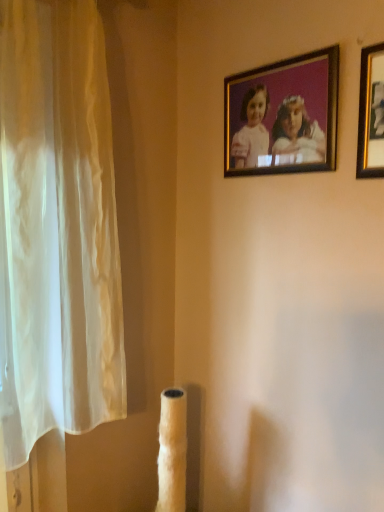
The width and height of the screenshot is (384, 512). What do you see at coordinates (371, 114) in the screenshot? I see `gold-framed picture at upper right, acting as the first picture frame starting from the right` at bounding box center [371, 114].

The width and height of the screenshot is (384, 512). I want to click on gold-framed picture at upper right, which ranks as the 2th picture frame in back-to-front order, so click(x=371, y=114).

Describe the element at coordinates (283, 114) in the screenshot. The width and height of the screenshot is (384, 512). I see `gold-framed photo at upper center, which is the first picture frame in back-to-front order` at that location.

You are a GUI agent. You are given a task and a screenshot of the screen. Output one action in this format:
    pyautogui.click(x=<x>, y=<y>)
    Task: Click on the gold-framed photo at upper center, which is the first picture frame in back-to-front order
    
    Given the screenshot: What is the action you would take?
    pyautogui.click(x=283, y=114)

Locate an element on the screen. The image size is (384, 512). gold-framed picture at upper right, which appears as the 2th picture frame when viewed from the left is located at coordinates (371, 114).

Does gold-framed picture at upper right, which appears as the 2th picture frame when viewed from the left, appear on the right side of gold-framed photo at upper center, which is the first picture frame in back-to-front order?

Yes, gold-framed picture at upper right, which appears as the 2th picture frame when viewed from the left, is to the right of gold-framed photo at upper center, which is the first picture frame in back-to-front order.

Which is behind, gold-framed picture at upper right, which appears as the 2th picture frame when viewed from the left, or gold-framed photo at upper center, the first picture frame when ordered from left to right?

gold-framed photo at upper center, the first picture frame when ordered from left to right, is behind.

Which is in front, point (368, 83) or point (326, 80)?

Point (368, 83)

From the image's perspective, does gold-framed picture at upper right, which ranks as the 2th picture frame in back-to-front order, appear lower than gold-framed photo at upper center, the first picture frame when ordered from left to right?

Yes.

From a real-world perspective, does gold-framed picture at upper right, which is counted as the 1th picture frame, starting from the front, sit lower than gold-framed photo at upper center, marked as the second picture frame in a front-to-back arrangement?

Correct, in the physical world, gold-framed picture at upper right, which is counted as the 1th picture frame, starting from the front, is lower than gold-framed photo at upper center, marked as the second picture frame in a front-to-back arrangement.

Between gold-framed picture at upper right, which ranks as the 2th picture frame in back-to-front order, and gold-framed photo at upper center, marked as the second picture frame in a front-to-back arrangement, which one has smaller width?

Thinner between the two is gold-framed picture at upper right, which ranks as the 2th picture frame in back-to-front order.

Is gold-framed picture at upper right, which appears as the 2th picture frame when viewed from the left, shorter than gold-framed photo at upper center, marked as the second picture frame in a front-to-back arrangement?

No, gold-framed picture at upper right, which appears as the 2th picture frame when viewed from the left, is not shorter than gold-framed photo at upper center, marked as the second picture frame in a front-to-back arrangement.

Does gold-framed picture at upper right, which appears as the 2th picture frame when viewed from the left, have a smaller size compared to gold-framed photo at upper center, the first picture frame when ordered from left to right?

Indeed, gold-framed picture at upper right, which appears as the 2th picture frame when viewed from the left, has a smaller size compared to gold-framed photo at upper center, the first picture frame when ordered from left to right.

Do you think gold-framed picture at upper right, which ranks as the 2th picture frame in back-to-front order, is within gold-framed photo at upper center, which is the first picture frame in back-to-front order, or outside of it?

The correct answer is: outside.

Are gold-framed picture at upper right, which appears as the 2th picture frame when viewed from the left, and gold-framed photo at upper center, the first picture frame when ordered from left to right, beside each other?

No, gold-framed picture at upper right, which appears as the 2th picture frame when viewed from the left, is not making contact with gold-framed photo at upper center, the first picture frame when ordered from left to right.

Is gold-framed picture at upper right, acting as the first picture frame starting from the right, oriented away from gold-framed photo at upper center, the first picture frame when ordered from left to right?

No, gold-framed picture at upper right, acting as the first picture frame starting from the right, is not facing the opposite direction of gold-framed photo at upper center, the first picture frame when ordered from left to right.

Locate an element on the screen. picture frame beneath the gold-framed photo at upper center, the first picture frame when ordered from left to right (from a real-world perspective) is located at coordinates click(x=371, y=114).

Between gold-framed photo at upper center, marked as the second picture frame in a front-to-back arrangement, and gold-framed picture at upper right, which ranks as the 2th picture frame in back-to-front order, which one appears on the right side from the viewer's perspective?

Positioned to the right is gold-framed picture at upper right, which ranks as the 2th picture frame in back-to-front order.

Between gold-framed photo at upper center, the first picture frame when ordered from left to right, and gold-framed picture at upper right, acting as the first picture frame starting from the right, which one is positioned in front?

gold-framed picture at upper right, acting as the first picture frame starting from the right.

Is point (258, 137) closer or farther from the camera than point (368, 67)?

Point (258, 137) appears to be farther away from the viewer than point (368, 67).

From the image's perspective, is gold-framed photo at upper center, the 2th picture frame from the right, beneath gold-framed picture at upper right, which is counted as the 1th picture frame, starting from the front?

Incorrect, from the image's perspective, gold-framed photo at upper center, the 2th picture frame from the right, is higher than gold-framed picture at upper right, which is counted as the 1th picture frame, starting from the front.

From a real-world perspective, is gold-framed photo at upper center, the first picture frame when ordered from left to right, under gold-framed picture at upper right, acting as the first picture frame starting from the right?

No, from a real-world perspective, gold-framed photo at upper center, the first picture frame when ordered from left to right, is not under gold-framed picture at upper right, acting as the first picture frame starting from the right.

Which object is thinner, gold-framed photo at upper center, the first picture frame when ordered from left to right, or gold-framed picture at upper right, acting as the first picture frame starting from the right?

gold-framed picture at upper right, acting as the first picture frame starting from the right, is thinner.

Consider the image. Between gold-framed photo at upper center, the 2th picture frame from the right, and gold-framed picture at upper right, which appears as the 2th picture frame when viewed from the left, which one has less height?

Standing shorter between the two is gold-framed photo at upper center, the 2th picture frame from the right.

Is gold-framed photo at upper center, the first picture frame when ordered from left to right, bigger or smaller than gold-framed picture at upper right, which ranks as the 2th picture frame in back-to-front order?

Considering their sizes, gold-framed photo at upper center, the first picture frame when ordered from left to right, takes up more space than gold-framed picture at upper right, which ranks as the 2th picture frame in back-to-front order.

Is gold-framed photo at upper center, marked as the second picture frame in a front-to-back arrangement, outside of gold-framed picture at upper right, acting as the first picture frame starting from the right?

Yes.

Are gold-framed photo at upper center, marked as the second picture frame in a front-to-back arrangement, and gold-framed picture at upper right, acting as the first picture frame starting from the right, far apart?

No, gold-framed photo at upper center, marked as the second picture frame in a front-to-back arrangement, is not far away from gold-framed picture at upper right, acting as the first picture frame starting from the right.

Could you tell me if gold-framed photo at upper center, marked as the second picture frame in a front-to-back arrangement, is facing gold-framed picture at upper right, which appears as the 2th picture frame when viewed from the left?

No, gold-framed photo at upper center, marked as the second picture frame in a front-to-back arrangement, is not turned towards gold-framed picture at upper right, which appears as the 2th picture frame when viewed from the left.

Based on the photo, could you measure the distance between gold-framed photo at upper center, marked as the second picture frame in a front-to-back arrangement, and gold-framed picture at upper right, which ranks as the 2th picture frame in back-to-front order?

The distance of gold-framed photo at upper center, marked as the second picture frame in a front-to-back arrangement, from gold-framed picture at upper right, which ranks as the 2th picture frame in back-to-front order, is 23.60 centimeters.

This screenshot has height=512, width=384. In order to click on picture frame above the gold-framed picture at upper right, which appears as the 2th picture frame when viewed from the left (from the image's perspective) in this screenshot , I will do (x=283, y=114).

Find the location of a particular element. This screenshot has height=512, width=384. picture frame above the gold-framed picture at upper right, which appears as the 2th picture frame when viewed from the left (from a real-world perspective) is located at coordinates (283, 114).

Image resolution: width=384 pixels, height=512 pixels. Identify the location of picture frame below the gold-framed photo at upper center, which is the first picture frame in back-to-front order (from a real-world perspective). (371, 114).